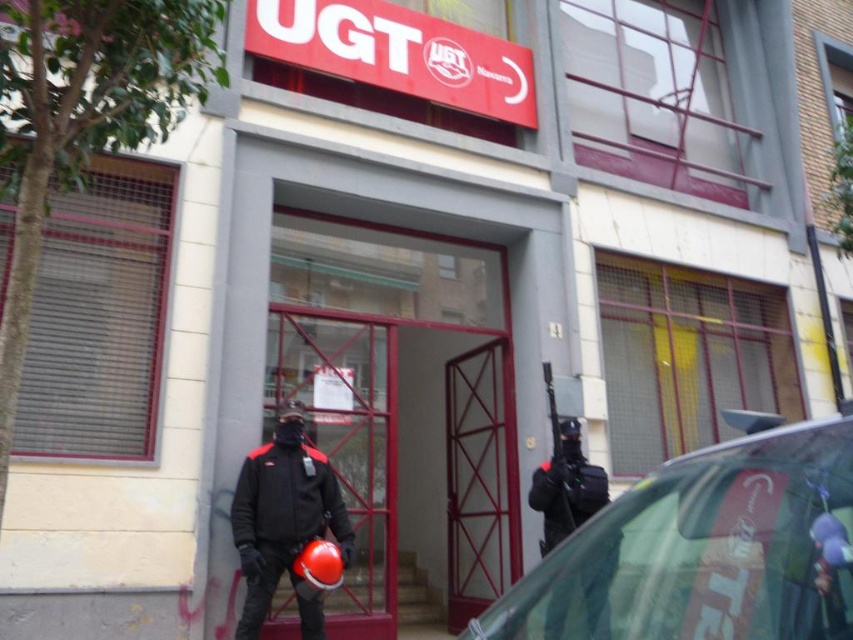
Who is more distant from viewer, (544, 515) or (550, 412)?

Point (550, 412)

Does point (560, 422) come closer to viewer compared to point (547, 384)?

That is False.

What do you see at coordinates (566, 486) in the screenshot? I see `black matte uniform at center` at bounding box center [566, 486].

Locate an element on the screen. black matte uniform at center is located at coordinates (566, 486).

Which is in front, point (276, 456) or point (555, 509)?

Point (276, 456)

Is matte black jacket at center positioned at the back of black matte uniform at center?

No, it is not.

Is point (242, 637) farther from camera compared to point (572, 435)?

That is False.

I want to click on matte black jacket at center, so click(x=282, y=513).

Measure the distance between transparent glass car at right and black plastic gun at center.

A distance of 8.11 feet exists between transparent glass car at right and black plastic gun at center.

This screenshot has height=640, width=853. What do you see at coordinates (705, 548) in the screenshot?
I see `transparent glass car at right` at bounding box center [705, 548].

Locate an element on the screen. This screenshot has height=640, width=853. transparent glass car at right is located at coordinates (705, 548).